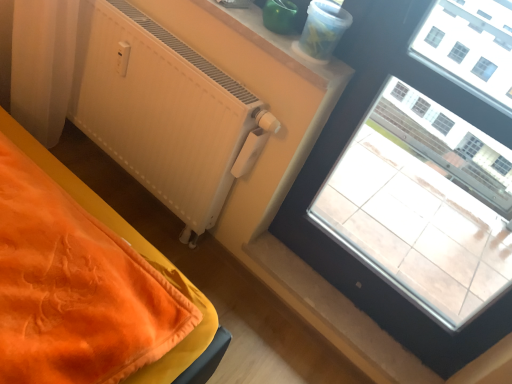
Find the location of a particular element. The image size is (512, 384). white matte radiator at upper left is located at coordinates (165, 113).

In order to face smooth plastic container at upper center, should I rotate leftwards or rightwards?

→ You should rotate right by 2.258 degrees.

Locate an element on the screen. The width and height of the screenshot is (512, 384). white matte radiator at upper left is located at coordinates (165, 113).

Which object is further away from the camera taking this photo, transparent glass window at upper right or white matte radiator at upper left?

white matte radiator at upper left is behind.

Measure the distance between transparent glass window at upper right and white matte radiator at upper left.

A distance of 21.40 inches exists between transparent glass window at upper right and white matte radiator at upper left.

Does transparent glass window at upper right have a lesser width compared to white matte radiator at upper left?

Indeed, transparent glass window at upper right has a lesser width compared to white matte radiator at upper left.

In terms of size, does transparent glass window at upper right appear bigger or smaller than white matte radiator at upper left?

In the image, transparent glass window at upper right appears to be smaller than white matte radiator at upper left.

In the image, is smooth plastic container at upper center on the left side or the right side of transparent glass window at upper right?

smooth plastic container at upper center is positioned on transparent glass window at upper right's left side.

What's the angular difference between smooth plastic container at upper center and transparent glass window at upper right's facing directions?

The angular difference between smooth plastic container at upper center and transparent glass window at upper right is 1.31 degrees.

Between smooth plastic container at upper center and transparent glass window at upper right, which one has less height?

smooth plastic container at upper center.

Is transparent glass window at upper right at the back of smooth plastic container at upper center?

No, transparent glass window at upper right is not at the back of smooth plastic container at upper center.

Is white matte radiator at upper left closer to the viewer compared to smooth plastic container at upper center?

No, white matte radiator at upper left is further to the viewer.

Does white matte radiator at upper left have a greater height compared to smooth plastic container at upper center?

Correct, white matte radiator at upper left is much taller as smooth plastic container at upper center.

Is white matte radiator at upper left bigger or smaller than smooth plastic container at upper center?

In the image, white matte radiator at upper left appears to be larger than smooth plastic container at upper center.

Is white matte radiator at upper left inside or outside of smooth plastic container at upper center?

white matte radiator at upper left is not enclosed by smooth plastic container at upper center.

Is smooth plastic container at upper center located within transparent glass window at upper right?

No, transparent glass window at upper right does not contain smooth plastic container at upper center.

How much distance is there between transparent glass window at upper right and smooth plastic container at upper center?

15.66 inches.

Is transparent glass window at upper right taller than smooth plastic container at upper center?

Indeed, transparent glass window at upper right has a greater height compared to smooth plastic container at upper center.

Considering the points (445, 367) and (248, 15), which point is in front, point (445, 367) or point (248, 15)?

The point (248, 15) is closer.

Where is `radiator that appears on the left of transparent glass window at upper right`? The image size is (512, 384). radiator that appears on the left of transparent glass window at upper right is located at coordinates (165, 113).

How much distance is there between white matte radiator at upper left and transparent glass window at upper right?

They are 21.40 inches apart.

From the image's perspective, which one is positioned lower, white matte radiator at upper left or transparent glass window at upper right?

transparent glass window at upper right appears lower in the image.

Considering the relative sizes of white matte radiator at upper left and transparent glass window at upper right in the image provided, is white matte radiator at upper left bigger than transparent glass window at upper right?

Yes, white matte radiator at upper left is bigger than transparent glass window at upper right.

Considering the sizes of objects smooth plastic container at upper center and white matte radiator at upper left in the image provided, who is smaller, smooth plastic container at upper center or white matte radiator at upper left?

smooth plastic container at upper center.

Does point (256, 37) come closer to viewer compared to point (117, 104)?

Yes, it is.

Between smooth plastic container at upper center and white matte radiator at upper left, which one appears on the right side from the viewer's perspective?

Positioned to the right is smooth plastic container at upper center.

The height and width of the screenshot is (384, 512). I want to click on radiator behind the transparent glass window at upper right, so click(x=165, y=113).

The width and height of the screenshot is (512, 384). In the image, there is a smooth plastic container at upper center. Identify the location of window below it (from a real-world perspective). (341, 246).

Estimate the real-world distances between objects in this image. Which object is further from transparent glass window at upper right, white matte radiator at upper left or smooth plastic container at upper center?

Among the two, white matte radiator at upper left is located further to transparent glass window at upper right.

Considering their positions, is white matte radiator at upper left positioned closer to smooth plastic container at upper center than transparent glass window at upper right?

white matte radiator at upper left lies closer to smooth plastic container at upper center than the other object.

Estimate the real-world distances between objects in this image. Which object is closer to white matte radiator at upper left, transparent glass window at upper right or smooth plastic container at upper center?

The object closer to white matte radiator at upper left is smooth plastic container at upper center.

Based on their spatial positions, is transparent glass window at upper right or white matte radiator at upper left further from smooth plastic container at upper center?

transparent glass window at upper right is further to smooth plastic container at upper center.

When comparing their distances from white matte radiator at upper left, does smooth plastic container at upper center or transparent glass window at upper right seem further?

transparent glass window at upper right is positioned further to the anchor white matte radiator at upper left.

Estimate the real-world distances between objects in this image. Which object is closer to transparent glass window at upper right, smooth plastic container at upper center or white matte radiator at upper left?

smooth plastic container at upper center.

Identify the location of window sill between white matte radiator at upper left and transparent glass window at upper right from left to right. This screenshot has height=384, width=512. (275, 44).